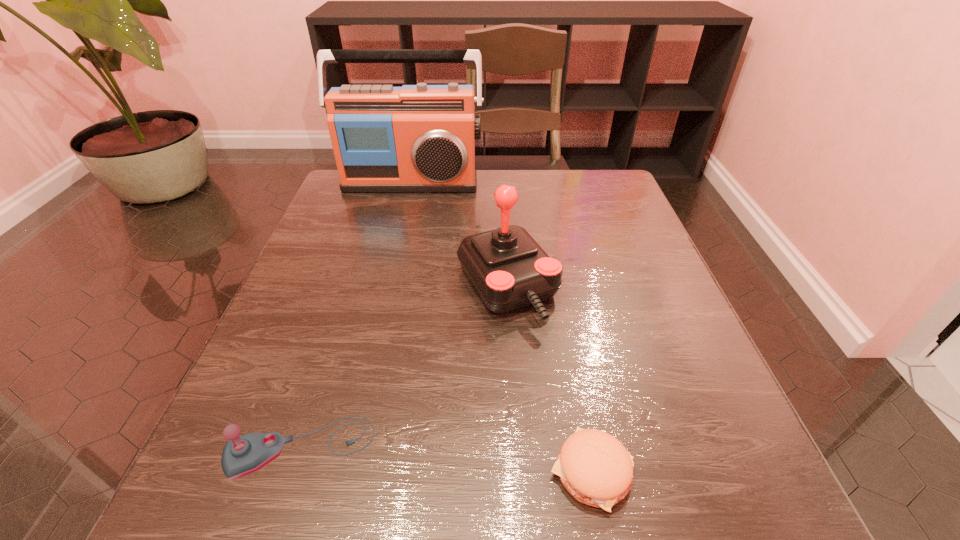
Identify the location of empty location between the radio receiver and the taller joystick. (459, 235).

Find the location of a particular element. The image size is (960, 540). free area in between the radio receiver and the second shortest object is located at coordinates (356, 315).

Find the location of a particular element. The image size is (960, 540). empty location between the patty and the farthest object is located at coordinates (501, 327).

At what (x,y) coordinates should I click in order to perform the action: click on free space that is in between the third tallest object and the patty. Please return your answer as a coordinate pair (x, y). This screenshot has height=540, width=960. Looking at the image, I should click on (446, 460).

Find the location of a particular element. The height and width of the screenshot is (540, 960). free space between the shortest object and the radio receiver is located at coordinates (501, 327).

You are a GUI agent. You are given a task and a screenshot of the screen. Output one action in this format:
    pyautogui.click(x=<x>, y=<y>)
    Task: Click on the vacant space in between the tallest object and the shortest object
    Image resolution: width=960 pixels, height=540 pixels.
    Given the screenshot: What is the action you would take?
    pyautogui.click(x=501, y=327)

What are the coordinates of `object that stands as the second closest to the right joystick` in the screenshot? It's located at (243, 455).

Identify the location of the third closest object relative to the second tallest object. The height and width of the screenshot is (540, 960). (416, 138).

I want to click on blank space that satisfies the following two spatial constraints: 1. on the front-facing side of the radio receiver; 2. on the left side of the shortest object, so click(342, 471).

This screenshot has height=540, width=960. I want to click on vacant space that satisfies the following two spatial constraints: 1. on the back side of the shorter joystick; 2. on the right side of the second farthest object, so click(353, 286).